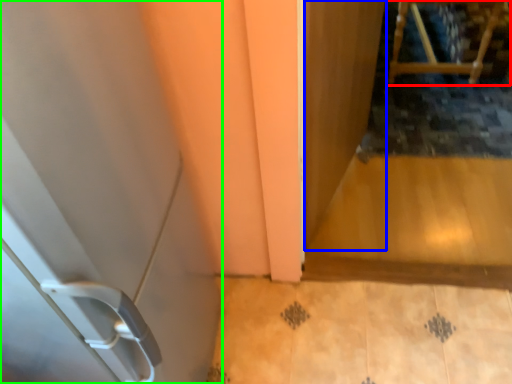
Question: Considering the real-world distances, which object is farthest from furniture (highlighted by a red box)? screen door (highlighted by a blue box) or door (highlighted by a green box)?

Choices:
 (A) screen door
 (B) door

Answer: (B)